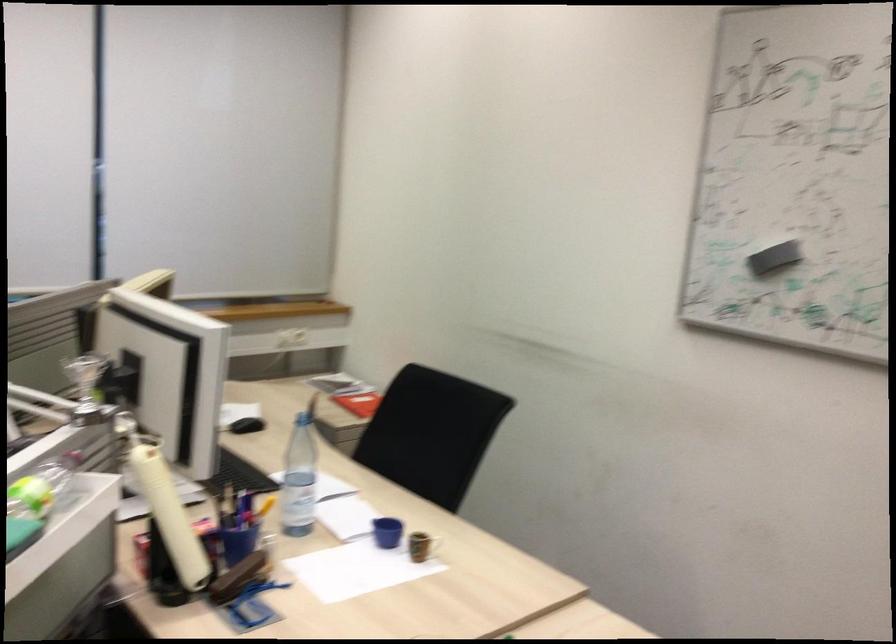
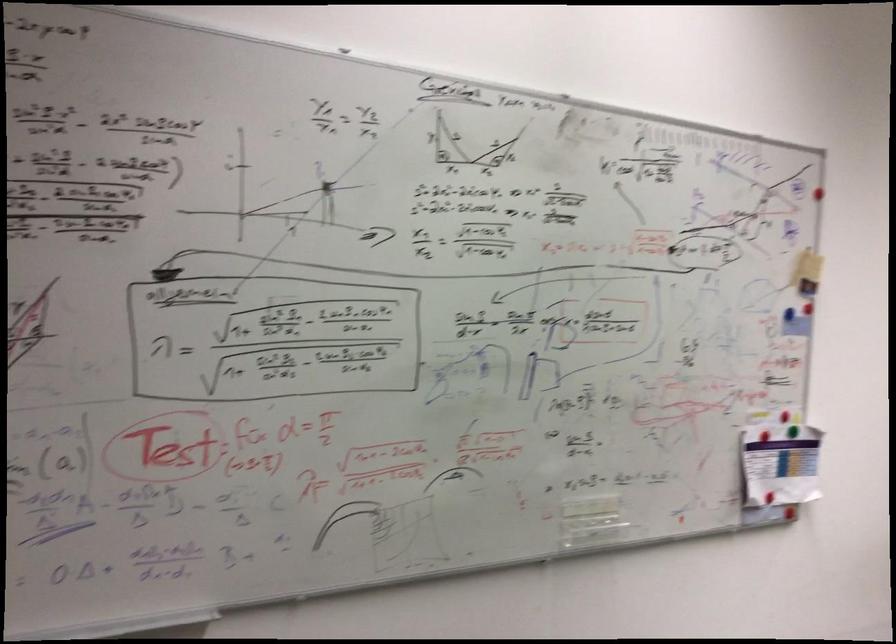
Question: The camera is either moving clockwise (left) or counter-clockwise (right) around the object. The first image is from the beginning of the video and the second image is from the end. Is the camera moving left or right when shooting the video?

Choices:
 (A) Left
 (B) Right

Answer: (B)